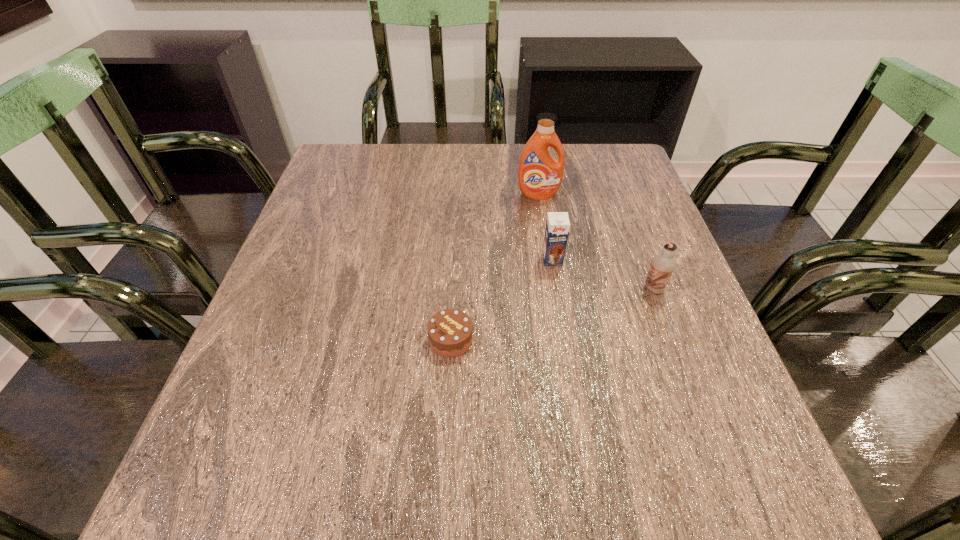
This screenshot has height=540, width=960. I want to click on vacant space situated 0.240m on the back of the second nearest object, so click(625, 211).

The height and width of the screenshot is (540, 960). I want to click on free location located on the right of the chocolate cake, so click(656, 340).

At what (x,y) coordinates should I click in order to perform the action: click on object at the far edge. Please return your answer as a coordinate pair (x, y). This screenshot has width=960, height=540. Looking at the image, I should click on (539, 175).

Find the location of `object that is at the right edge`. object that is at the right edge is located at coordinates (662, 266).

Identify the location of free space at the far edge of the desktop. The image size is (960, 540). (393, 177).

The height and width of the screenshot is (540, 960). In the image, there is a desktop. In order to click on vacant space at the near edge in this screenshot , I will do `click(325, 477)`.

In the image, there is a desktop. Find the location of `vacant space at the left edge`. vacant space at the left edge is located at coordinates (282, 263).

Image resolution: width=960 pixels, height=540 pixels. What are the coordinates of `free location at the right edge of the desktop` in the screenshot? It's located at (588, 204).

Where is `vacant space at the far left corner of the desktop`? vacant space at the far left corner of the desktop is located at coordinates (361, 185).

The height and width of the screenshot is (540, 960). Find the location of `blank space at the near left corner of the desktop`. blank space at the near left corner of the desktop is located at coordinates (211, 487).